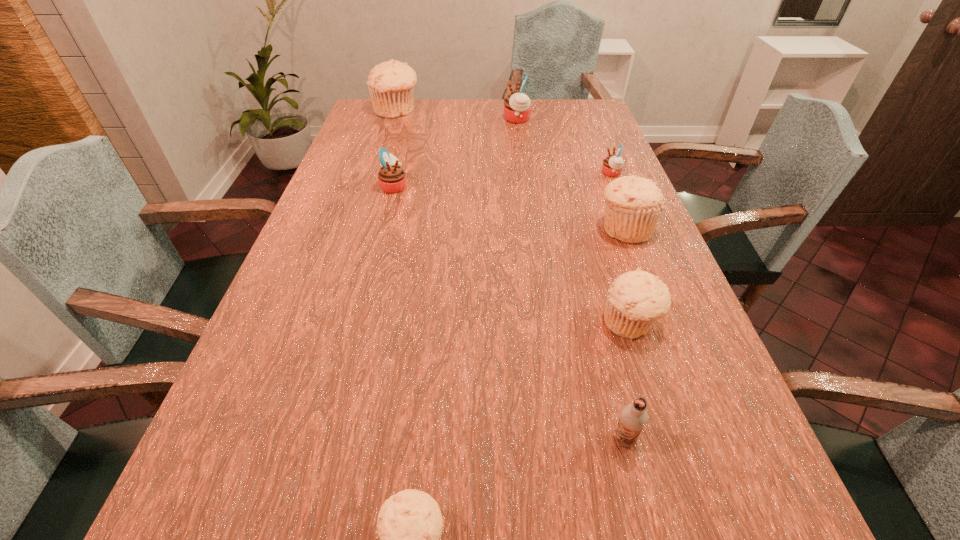
You are a GUI agent. You are given a task and a screenshot of the screen. Output one action in this format:
    pyautogui.click(x=<x>, y=<y>)
    Task: Click on the rightmost pink muffin
    The image size is (960, 540).
    Given the screenshot: What is the action you would take?
    pyautogui.click(x=612, y=166)

You are a GUI agent. You are given a task and a screenshot of the screen. Output one action in this format:
    pyautogui.click(x=<x>, y=<y>)
    Task: Click on the vacant position located 0.180m on the right of the biggest beige muffin
    
    Given the screenshot: What is the action you would take?
    pyautogui.click(x=468, y=111)

Locate an element on the screen. vacant space located on the front-facing side of the fourth object from left to right is located at coordinates (484, 119).

What are the coordinates of `free space located 0.400m on the front-facing side of the fourth object from left to right` in the screenshot? It's located at pyautogui.click(x=393, y=119).

What are the coordinates of `vacant region located 0.310m on the front-facing side of the fourth object from left to right` in the screenshot? It's located at (418, 119).

The image size is (960, 540). I want to click on free region located 0.380m on the left of the third nearest muffin, so click(448, 229).

At what (x,y) coordinates should I click in order to perform the action: click on free region located on the front-facing side of the second biggest pink muffin. Please return your answer as a coordinate pair (x, y). The image size is (960, 540). Looking at the image, I should click on (487, 186).

Find the location of a particular element. The width and height of the screenshot is (960, 540). vacant space located on the right of the chocolate milk is located at coordinates (685, 439).

This screenshot has height=540, width=960. What are the coordinates of `vacant space situated on the front of the sixth farthest object` in the screenshot? It's located at (673, 457).

At what (x,y) coordinates should I click in order to perform the action: click on free region located 0.220m on the front-facing side of the smallest pink muffin. Please return your answer as a coordinate pair (x, y). Image resolution: width=960 pixels, height=540 pixels. Looking at the image, I should click on (528, 173).